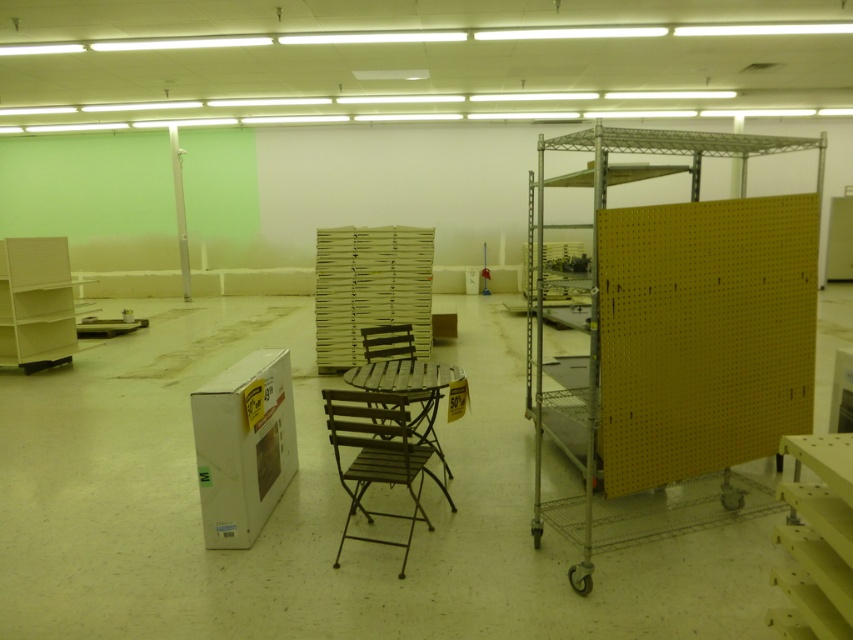
Question: Among these points, which one is farthest from the camera?

Choices:
 (A) (370, 522)
 (B) (387, 360)
 (C) (412, 428)

Answer: (B)

Question: Which point is farther to the camera?

Choices:
 (A) brown wood chair at center
 (B) brown metal chair at center
 (C) brown wood table at center
 (D) yellow pegboard at right

Answer: (A)

Question: Which object appears closest to the camera in this image?

Choices:
 (A) yellow pegboard at right
 (B) brown metal chair at center
 (C) brown wood table at center

Answer: (A)

Question: Is yellow pegboard at right smaller than yellow matte shelf at lower right?

Choices:
 (A) no
 (B) yes

Answer: (A)

Question: Can you confirm if yellow pegboard at right is smaller than brown wood chair at center?

Choices:
 (A) yes
 (B) no

Answer: (B)

Question: Does yellow pegboard at right have a larger size compared to yellow matte shelf at lower right?

Choices:
 (A) yes
 (B) no

Answer: (A)